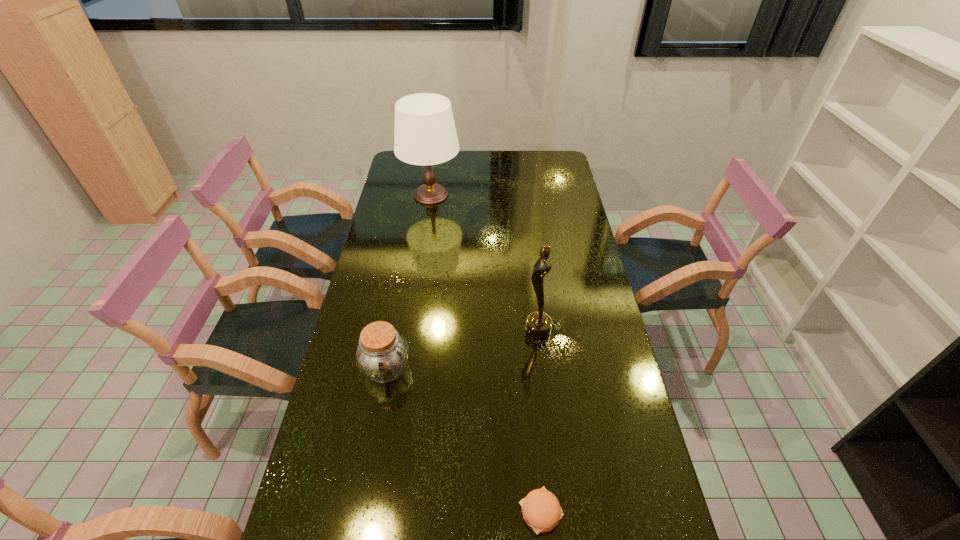
Find the location of a particular element. the farthest object is located at coordinates (425, 134).

The height and width of the screenshot is (540, 960). I want to click on lamp, so click(425, 134).

Locate an element on the screen. The image size is (960, 540). the third shortest object is located at coordinates (538, 324).

The height and width of the screenshot is (540, 960). Identify the location of the second farthest object. (538, 324).

The image size is (960, 540). Identify the location of the third tallest object. (382, 354).

This screenshot has height=540, width=960. In order to click on jar in this screenshot , I will do `click(382, 354)`.

Image resolution: width=960 pixels, height=540 pixels. Find the location of `the shortest object`. the shortest object is located at coordinates (541, 510).

At what (x,y) coordinates should I click in order to perform the action: click on the nearest object. Please return your answer as a coordinate pair (x, y). The image size is (960, 540). Looking at the image, I should click on [x=541, y=510].

Image resolution: width=960 pixels, height=540 pixels. What are the coordinates of `free space located on the back of the lamp` in the screenshot? It's located at (x=435, y=168).

Image resolution: width=960 pixels, height=540 pixels. Find the location of `free space located on the front-facing side of the second farthest object`. free space located on the front-facing side of the second farthest object is located at coordinates (408, 331).